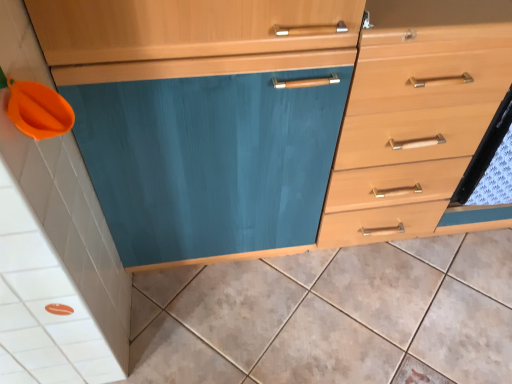
The width and height of the screenshot is (512, 384). In order to click on light wood drawer at center right in this screenshot , I will do `click(409, 138)`.

What do you see at coordinates (409, 138) in the screenshot?
I see `light wood drawer at center right` at bounding box center [409, 138].

Find the location of a particular element. This screenshot has height=384, width=512. matte ceramic tile at lower left is located at coordinates (332, 316).

What do you see at coordinates (332, 316) in the screenshot? I see `matte ceramic tile at lower left` at bounding box center [332, 316].

The image size is (512, 384). In order to click on light wood drawer at center right in this screenshot , I will do `click(409, 138)`.

Can you confirm if matte ceramic tile at lower left is positioned to the right of light wood drawer at center right?

No, matte ceramic tile at lower left is not to the right of light wood drawer at center right.

Is matte ceramic tile at lower left closer to camera compared to light wood drawer at center right?

That is False.

Considering the positions of point (459, 367) and point (382, 207), is point (459, 367) closer or farther from the camera than point (382, 207)?

Point (459, 367) is positioned closer to the camera compared to point (382, 207).

From the image's perspective, which is above, matte ceramic tile at lower left or light wood drawer at center right?

light wood drawer at center right appears higher in the image.

From a real-world perspective, is matte ceramic tile at lower left physically below light wood drawer at center right?

Yes, from a real-world perspective, matte ceramic tile at lower left is beneath light wood drawer at center right.

Which of these two, matte ceramic tile at lower left or light wood drawer at center right, is wider?

matte ceramic tile at lower left.

Can you confirm if matte ceramic tile at lower left is shorter than light wood drawer at center right?

Indeed, matte ceramic tile at lower left has a lesser height compared to light wood drawer at center right.

Between matte ceramic tile at lower left and light wood drawer at center right, which one has larger size?

With larger size is light wood drawer at center right.

Is matte ceramic tile at lower left outside of light wood drawer at center right?

That's correct, matte ceramic tile at lower left is outside of light wood drawer at center right.

Is matte ceramic tile at lower left far away from light wood drawer at center right?

No, matte ceramic tile at lower left is not far from light wood drawer at center right.

Is matte ceramic tile at lower left looking in the opposite direction of light wood drawer at center right?

That's not correct — matte ceramic tile at lower left is not looking away from light wood drawer at center right.

How different are the orientations of matte ceramic tile at lower left and light wood drawer at center right in degrees?

There is a 90.1-degree angle between the facing directions of matte ceramic tile at lower left and light wood drawer at center right.

At what (x,y) coordinates should I click in order to perform the action: click on ceramic tile below the light wood drawer at center right (from a real-world perspective). Please return your answer as a coordinate pair (x, y). This screenshot has height=384, width=512. Looking at the image, I should click on (332, 316).

Considering the positions of objects light wood drawer at center right and matte ceramic tile at lower left in the image provided, who is more to the right, light wood drawer at center right or matte ceramic tile at lower left?

light wood drawer at center right is more to the right.

Is light wood drawer at center right closer to the viewer compared to matte ceramic tile at lower left?

Yes, the depth of light wood drawer at center right is less than that of matte ceramic tile at lower left.

Is point (428, 224) in front of point (355, 346)?

No, (428, 224) is further to viewer.

From the image's perspective, does light wood drawer at center right appear lower than matte ceramic tile at lower left?

Incorrect, from the image's perspective, light wood drawer at center right is higher than matte ceramic tile at lower left.

From a real-world perspective, is light wood drawer at center right below matte ceramic tile at lower left?

Incorrect, from a real-world perspective, light wood drawer at center right is higher than matte ceramic tile at lower left.

Can you confirm if light wood drawer at center right is thinner than matte ceramic tile at lower left?

Correct, the width of light wood drawer at center right is less than that of matte ceramic tile at lower left.

Considering the relative sizes of light wood drawer at center right and matte ceramic tile at lower left in the image provided, is light wood drawer at center right taller than matte ceramic tile at lower left?

Indeed, light wood drawer at center right has a greater height compared to matte ceramic tile at lower left.

Which of these two, light wood drawer at center right or matte ceramic tile at lower left, is smaller?

Smaller between the two is matte ceramic tile at lower left.

Would you say matte ceramic tile at lower left is part of light wood drawer at center right's contents?

No, matte ceramic tile at lower left is not a part of light wood drawer at center right.

Are light wood drawer at center right and matte ceramic tile at lower left making contact?

They are not placed beside each other.

Is light wood drawer at center right oriented towards matte ceramic tile at lower left?

Yes, light wood drawer at center right is oriented towards matte ceramic tile at lower left.

What's the angular difference between light wood drawer at center right and matte ceramic tile at lower left's facing directions?

They differ by 90.1 degrees in their facing directions.

I want to click on ceramic tile that appears below the light wood drawer at center right (from the image's perspective), so click(x=332, y=316).

At what (x,y) coordinates should I click in order to perform the action: click on ceramic tile located underneath the light wood drawer at center right (from a real-world perspective). Please return your answer as a coordinate pair (x, y). The image size is (512, 384). Looking at the image, I should click on (332, 316).

You are a GUI agent. You are given a task and a screenshot of the screen. Output one action in this format:
    pyautogui.click(x=<x>, y=<y>)
    Task: Click on the drawer that is above the matte ceramic tile at lower left (from a real-world perspective)
    The image size is (512, 384).
    Given the screenshot: What is the action you would take?
    (x=409, y=138)